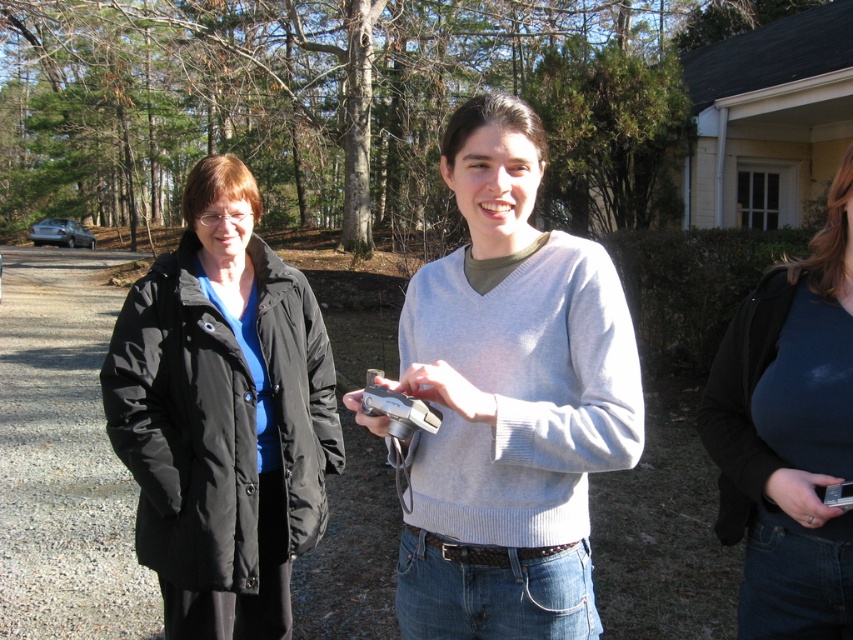
Question: Is black puffy coat at left smaller than dark blue jersey at center?

Choices:
 (A) no
 (B) yes

Answer: (A)

Question: Can you confirm if black puffy coat at left is positioned to the left of dark blue jersey at center?

Choices:
 (A) yes
 (B) no

Answer: (A)

Question: Considering the relative positions of black puffy coat at left and dark blue jersey at center in the image provided, where is black puffy coat at left located with respect to dark blue jersey at center?

Choices:
 (A) right
 (B) left

Answer: (B)

Question: Which point appears closest to the camera in this image?

Choices:
 (A) (802, 548)
 (B) (204, 467)

Answer: (A)